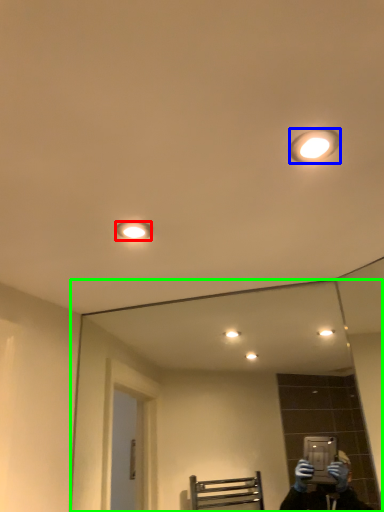
Question: Considering the real-world distances, which object is closest to light fixture (highlighted by a red box)? light fixture (highlighted by a blue box) or mirror (highlighted by a green box).

Choices:
 (A) light fixture
 (B) mirror

Answer: (A)